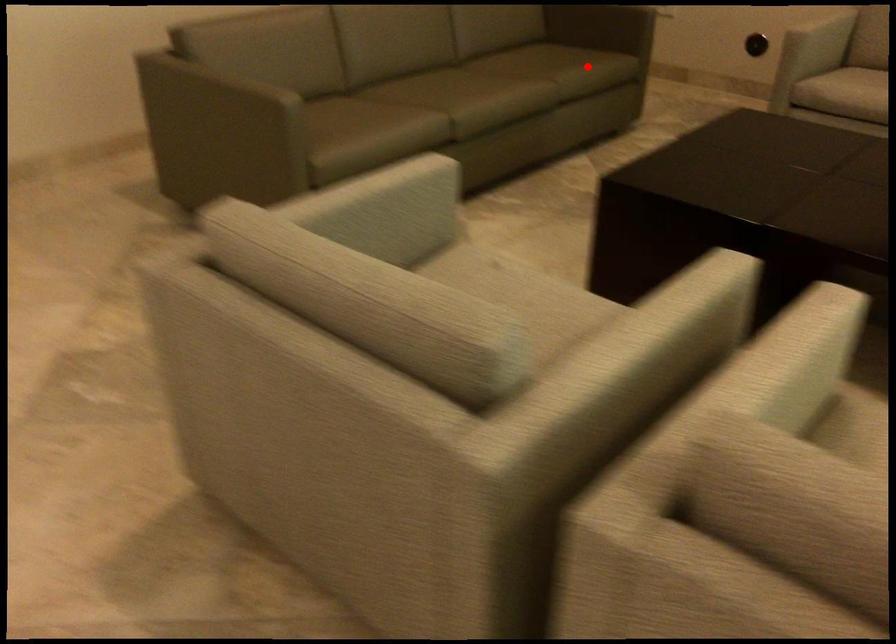
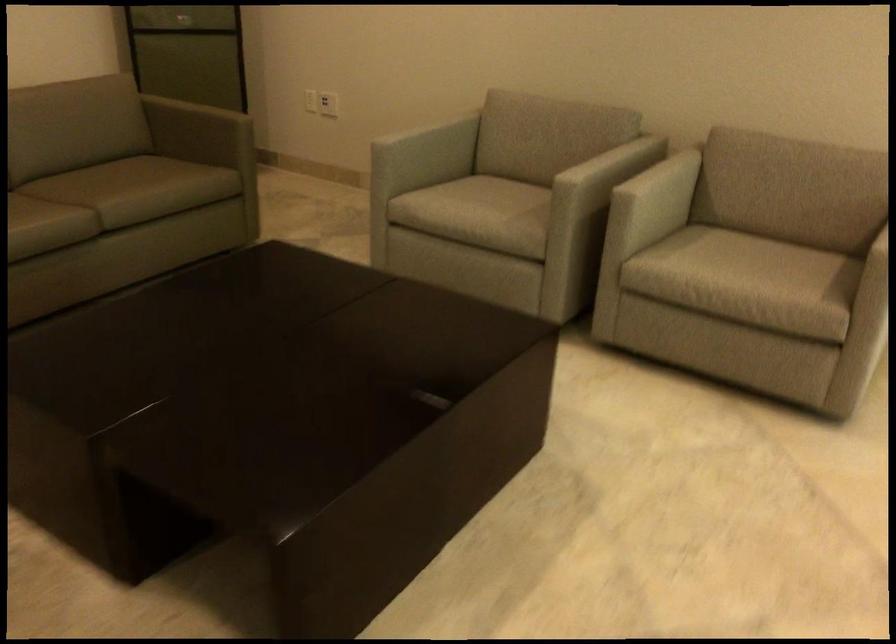
Question: A red point is marked in image1. In image2, is the corresponding 3D point closer to the camera or farther? Reply with the corresponding letter.

Choices:
 (A) The corresponding 3D point is closer.
 (B) The corresponding 3D point is farther.

Answer: (A)